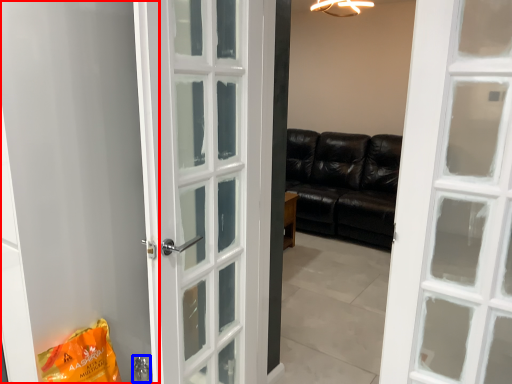
Question: Which object appears farthest to the camera in this image, screen door (highlighted by a red box) or door handle (highlighted by a blue box)?

Choices:
 (A) screen door
 (B) door handle

Answer: (B)